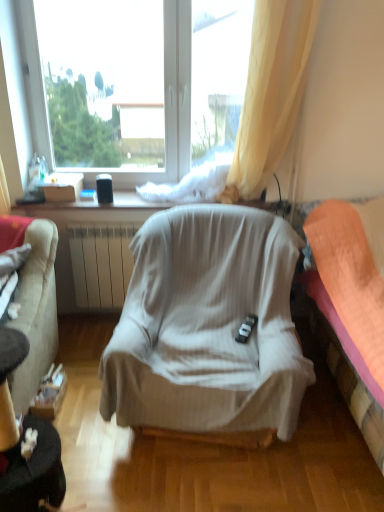
Question: Is white cardboard box at upper left not inside white matte window at upper center?

Choices:
 (A) yes
 (B) no

Answer: (A)

Question: From a real-world perspective, is white cardboard box at upper left physically above white matte window at upper center?

Choices:
 (A) yes
 (B) no

Answer: (B)

Question: Is white matte window at upper center completely or partially inside white cardboard box at upper left?

Choices:
 (A) yes
 (B) no

Answer: (B)

Question: Is white cardboard box at upper left looking in the opposite direction of white matte window at upper center?

Choices:
 (A) no
 (B) yes

Answer: (B)

Question: Is white cardboard box at upper left thinner than white matte window at upper center?

Choices:
 (A) no
 (B) yes

Answer: (A)

Question: Is white cardboard box at upper left oriented towards white matte window at upper center?

Choices:
 (A) yes
 (B) no

Answer: (B)

Question: Can you confirm if orange fabric bed at right is bigger than light beige fabric chair at center?

Choices:
 (A) yes
 (B) no

Answer: (A)

Question: Is orange fabric bed at right touching light beige fabric chair at center?

Choices:
 (A) no
 (B) yes

Answer: (A)

Question: Does orange fabric bed at right have a lesser height compared to light beige fabric chair at center?

Choices:
 (A) yes
 (B) no

Answer: (B)

Question: Is the depth of orange fabric bed at right less than that of light beige fabric chair at center?

Choices:
 (A) yes
 (B) no

Answer: (A)

Question: Considering the relative sizes of orange fabric bed at right and light beige fabric chair at center in the image provided, is orange fabric bed at right taller than light beige fabric chair at center?

Choices:
 (A) yes
 (B) no

Answer: (A)

Question: Is orange fabric bed at right thinner than light beige fabric chair at center?

Choices:
 (A) yes
 (B) no

Answer: (A)

Question: Is orange fabric bed at right behind white cardboard box at upper left?

Choices:
 (A) no
 (B) yes

Answer: (A)